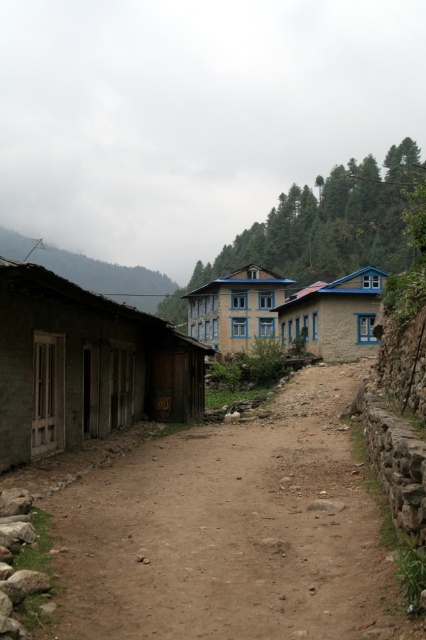
In the scene shown: You are a traveler who wants to find the taller building in the village. You see the blue stucco building at center and the yellow stone building at center. Which one should you look up to see?

The yellow stone building at center is taller than the blue stucco building at center, so you should look up to see the yellow stone building at center.

You are standing at the point with coordinates point (275, 285) and want to walk towards the point with coordinates point (339, 314). Which direction should you move in to reach your destination?

You should move towards the point (339, 314), which is closer to the camera than the point (275, 285), so you need to walk forward in the direction of the point (339, 314).

You are standing at the point with coordinates point (x=100, y=285) and want to walk towards the point with coordinates point (x=150, y=532). Which direction should you move relative to your current position?

You should move forward because point (x=150, y=532) is closer to the camera than point (x=100, y=285), meaning it is in front of your current position.